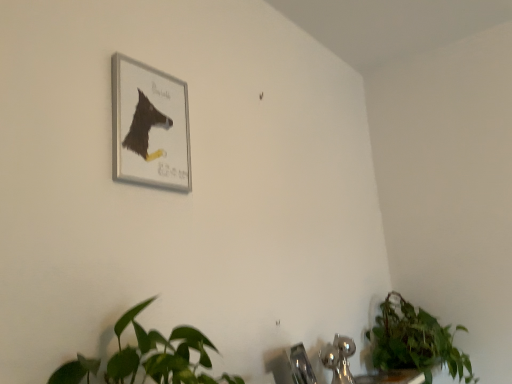
I want to click on satin nickel faucet at lower center, so click(x=301, y=365).

What is the approximate height of chrome metallic sink at lower center?

The height of chrome metallic sink at lower center is 7.85 inches.

Find the location of a particular element. The image size is (512, 384). chrome metallic sink at lower center is located at coordinates (293, 366).

Locate an element on the screen. This screenshot has height=384, width=512. silver metallic picture frame at upper left is located at coordinates point(150,126).

From a real-world perspective, who is located lower, satin nickel faucet at lower center or silver metallic picture frame at upper left?

In real-world perspective, satin nickel faucet at lower center is lower.

Is satin nickel faucet at lower center not close to silver metallic picture frame at upper left?

No, satin nickel faucet at lower center is not far away from silver metallic picture frame at upper left.

Is satin nickel faucet at lower center positioned beyond the bounds of silver metallic picture frame at upper left?

satin nickel faucet at lower center lies outside silver metallic picture frame at upper left's area.

Which of these two, satin nickel faucet at lower center or silver metallic picture frame at upper left, is bigger?

With larger size is silver metallic picture frame at upper left.

Considering the sizes of objects green leafy plant at lower right and chrome metallic sink at lower center in the image provided, who is wider, green leafy plant at lower right or chrome metallic sink at lower center?

green leafy plant at lower right.

Does green leafy plant at lower right have a smaller size compared to chrome metallic sink at lower center?

Actually, green leafy plant at lower right might be larger than chrome metallic sink at lower center.

Is point (387, 336) positioned after point (287, 361)?

Yes, it is behind point (287, 361).

Locate an element on the screen. This screenshot has height=384, width=512. houseplant that appears behind the chrome metallic sink at lower center is located at coordinates (413, 343).

Considering the relative sizes of chrome metallic sink at lower center and green leafy plant at lower right in the image provided, is chrome metallic sink at lower center bigger than green leafy plant at lower right?

No, chrome metallic sink at lower center is not bigger than green leafy plant at lower right.

Can you confirm if chrome metallic sink at lower center is thinner than green leafy plant at lower right?

Indeed, chrome metallic sink at lower center has a lesser width compared to green leafy plant at lower right.

Is chrome metallic sink at lower center far away from green leafy plant at lower right?

No, chrome metallic sink at lower center is not far from green leafy plant at lower right.

Can you confirm if silver metallic picture frame at upper left is shorter than green leafy plant at lower right?

Yes.

Can you confirm if silver metallic picture frame at upper left is wider than green leafy plant at lower right?

No.

Considering the positions of objects silver metallic picture frame at upper left and green leafy plant at lower right in the image provided, who is more to the left, silver metallic picture frame at upper left or green leafy plant at lower right?

From the viewer's perspective, silver metallic picture frame at upper left appears more on the left side.

Consider the image. Would you say silver metallic picture frame at upper left is a long distance from green leafy plant at lower right?

silver metallic picture frame at upper left is far away from green leafy plant at lower right.

From a real-world perspective, is silver metallic picture frame at upper left on top of chrome metallic sink at lower center?

Indeed, from a real-world perspective, silver metallic picture frame at upper left stands above chrome metallic sink at lower center.

Considering the sizes of objects silver metallic picture frame at upper left and chrome metallic sink at lower center in the image provided, who is shorter, silver metallic picture frame at upper left or chrome metallic sink at lower center?

chrome metallic sink at lower center is shorter.

Is silver metallic picture frame at upper left in front of chrome metallic sink at lower center?

Yes, the depth of silver metallic picture frame at upper left is less than that of chrome metallic sink at lower center.

Between silver metallic picture frame at upper left and chrome metallic sink at lower center, which one has smaller size?

Smaller between the two is silver metallic picture frame at upper left.

Which object is further away from the camera, chrome metallic sink at lower center or silver metallic picture frame at upper left?

chrome metallic sink at lower center is further from the camera.

Which of these two, chrome metallic sink at lower center or silver metallic picture frame at upper left, is bigger?

Bigger between the two is chrome metallic sink at lower center.

Where is `picture frame on the left of the chrome metallic sink at lower center`? The width and height of the screenshot is (512, 384). picture frame on the left of the chrome metallic sink at lower center is located at coordinates (150, 126).

Which is behind, point (175, 114) or point (307, 375)?

The point (307, 375) is more distant.

From the image's perspective, which is above, silver metallic picture frame at upper left or satin nickel faucet at lower center?

From the image's view, silver metallic picture frame at upper left is above.

This screenshot has width=512, height=384. What are the coordinates of `picture frame that appears above the satin nickel faucet at lower center (from the image's perspective)` in the screenshot? It's located at (150, 126).

Is silver metallic picture frame at upper left facing towards satin nickel faucet at lower center?

No, silver metallic picture frame at upper left is not facing towards satin nickel faucet at lower center.

The width and height of the screenshot is (512, 384). What are the coordinates of `faucet behind the silver metallic picture frame at upper left` in the screenshot? It's located at (301, 365).

At what (x,y) coordinates should I click in order to perform the action: click on sink that appears in front of the green leafy plant at lower right. Please return your answer as a coordinate pair (x, y). Looking at the image, I should click on (293, 366).

Which object lies further to the anchor point chrome metallic sink at lower center, satin nickel faucet at lower center or green leafy plant at lower right?

green leafy plant at lower right.

Which object lies further to the anchor point green leafy plant at lower right, silver metallic picture frame at upper left or chrome metallic sink at lower center?

Among the two, silver metallic picture frame at upper left is located further to green leafy plant at lower right.

Estimate the real-world distances between objects in this image. Which object is closer to silver metallic picture frame at upper left, satin nickel faucet at lower center or chrome metallic sink at lower center?

chrome metallic sink at lower center.

Looking at the image, which one is located closer to chrome metallic sink at lower center, green leafy plant at lower right or satin nickel faucet at lower center?

satin nickel faucet at lower center is closer to chrome metallic sink at lower center.

Estimate the real-world distances between objects in this image. Which object is further from satin nickel faucet at lower center, silver metallic picture frame at upper left or chrome metallic sink at lower center?

The object further to satin nickel faucet at lower center is silver metallic picture frame at upper left.

Looking at the image, which one is located closer to chrome metallic sink at lower center, green leafy plant at lower right or silver metallic picture frame at upper left?

Among the two, green leafy plant at lower right is located nearer to chrome metallic sink at lower center.

Looking at the image, which one is located closer to green leafy plant at lower right, chrome metallic sink at lower center or silver metallic picture frame at upper left?

The object closer to green leafy plant at lower right is chrome metallic sink at lower center.

Estimate the real-world distances between objects in this image. Which object is further from green leafy plant at lower right, satin nickel faucet at lower center or silver metallic picture frame at upper left?

Based on the image, silver metallic picture frame at upper left appears to be further to green leafy plant at lower right.

Locate an element on the screen. sink between satin nickel faucet at lower center and green leafy plant at lower right in the horizontal direction is located at coordinates (293, 366).

You are a GUI agent. You are given a task and a screenshot of the screen. Output one action in this format:
    pyautogui.click(x=<x>, y=<y>)
    Task: Click on the faucet situated between silver metallic picture frame at upper left and green leafy plant at lower right from left to right
    This screenshot has height=384, width=512.
    Given the screenshot: What is the action you would take?
    pyautogui.click(x=301, y=365)

Find the location of a particular element. faucet between silver metallic picture frame at upper left and chrome metallic sink at lower center vertically is located at coordinates (301, 365).

At what (x,y) coordinates should I click in order to perform the action: click on sink between silver metallic picture frame at upper left and green leafy plant at lower right. Please return your answer as a coordinate pair (x, y). Looking at the image, I should click on (293, 366).